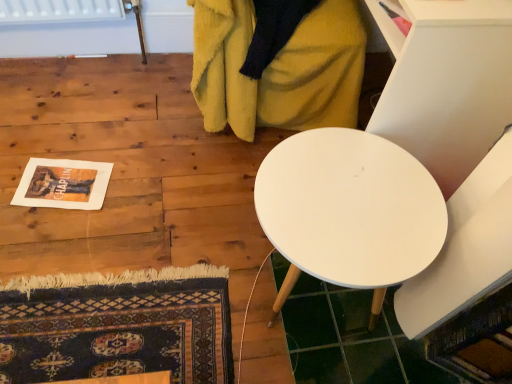
Find the location of a particular element. free space to the left of white matte table at center is located at coordinates coord(176,254).